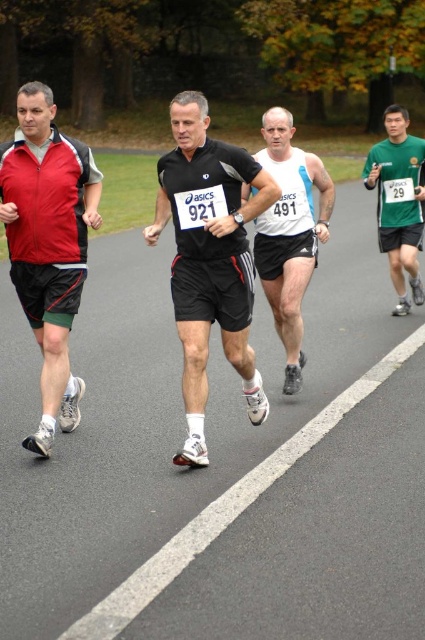
Can you confirm if black matte running shoe at center is positioned to the right of white matte running shirt at center?

Incorrect, black matte running shoe at center is not on the right side of white matte running shirt at center.

Based on the photo, does black matte running shoe at center have a smaller size compared to white matte running shirt at center?

No.

Identify the location of black matte running shoe at center. (209, 257).

The height and width of the screenshot is (640, 425). I want to click on black matte running shoe at center, so 209,257.

The height and width of the screenshot is (640, 425). What do you see at coordinates (48, 244) in the screenshot?
I see `matte red jacket at left` at bounding box center [48, 244].

Is point (47, 336) closer to viewer compared to point (368, 157)?

Yes, point (47, 336) is in front of point (368, 157).

Find the location of a particular element. Image resolution: width=425 pixels, height=640 pixels. matte red jacket at left is located at coordinates (48, 244).

Which is behind, point (73, 180) or point (280, 218)?

The point (280, 218) is behind.

How much distance is there between matte red jacket at left and white matte running shirt at center?

The distance of matte red jacket at left from white matte running shirt at center is 2.44 meters.

You are a GUI agent. You are given a task and a screenshot of the screen. Output one action in this format:
    pyautogui.click(x=<x>, y=<y>)
    Task: Click on the matte red jacket at left
    This screenshot has height=640, width=425.
    Given the screenshot: What is the action you would take?
    pyautogui.click(x=48, y=244)